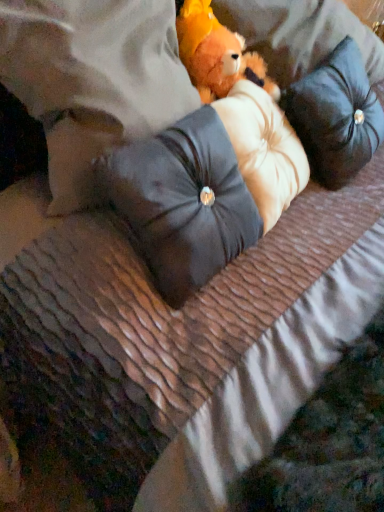
Question: From the image's perspective, does satin black pillow at center, which ranks as the second pillow in left-to-right order, appear lower than black velvet pillow at upper right, the 3th pillow when ordered from left to right?

Choices:
 (A) yes
 (B) no

Answer: (A)

Question: Is satin black pillow at center, which ranks as the second pillow in left-to-right order, touching black velvet pillow at upper right, placed as the 1th pillow when sorted from right to left?

Choices:
 (A) yes
 (B) no

Answer: (B)

Question: Is satin black pillow at center, the second pillow when ordered from right to left, to the left of black velvet pillow at upper right, placed as the 1th pillow when sorted from right to left, from the viewer's perspective?

Choices:
 (A) no
 (B) yes

Answer: (B)

Question: From the image's perspective, is satin black pillow at center, the second pillow when ordered from right to left, on black velvet pillow at upper right, the 3th pillow when ordered from left to right?

Choices:
 (A) yes
 (B) no

Answer: (B)

Question: Does satin black pillow at center, the second pillow when ordered from right to left, lie behind black velvet pillow at upper right, placed as the 1th pillow when sorted from right to left?

Choices:
 (A) no
 (B) yes

Answer: (A)

Question: From the image's perspective, is leather-like pillow at center, the third pillow from the right, positioned above or below black velvet pillow at upper right, placed as the 1th pillow when sorted from right to left?

Choices:
 (A) below
 (B) above

Answer: (B)

Question: From a real-world perspective, is leather-like pillow at center, which is counted as the first pillow, starting from the left, positioned above or below black velvet pillow at upper right, placed as the 1th pillow when sorted from right to left?

Choices:
 (A) below
 (B) above

Answer: (B)

Question: Considering the relative positions of leather-like pillow at center, the third pillow from the right, and black velvet pillow at upper right, placed as the 1th pillow when sorted from right to left, in the image provided, is leather-like pillow at center, the third pillow from the right, to the left or to the right of black velvet pillow at upper right, placed as the 1th pillow when sorted from right to left,?

Choices:
 (A) right
 (B) left

Answer: (B)

Question: Considering the positions of leather-like pillow at center, the third pillow from the right, and black velvet pillow at upper right, the 3th pillow when ordered from left to right, in the image, is leather-like pillow at center, the third pillow from the right, bigger or smaller than black velvet pillow at upper right, the 3th pillow when ordered from left to right,?

Choices:
 (A) small
 (B) big

Answer: (B)

Question: Relative to fluffy orange teddy bear at center, is black velvet pillow at upper right, the 3th pillow when ordered from left to right, in front or behind?

Choices:
 (A) front
 (B) behind

Answer: (A)

Question: From their relative heights in the image, would you say black velvet pillow at upper right, the 3th pillow when ordered from left to right, is taller or shorter than fluffy orange teddy bear at center?

Choices:
 (A) short
 (B) tall

Answer: (B)

Question: Is black velvet pillow at upper right, the 3th pillow when ordered from left to right, inside the boundaries of fluffy orange teddy bear at center, or outside?

Choices:
 (A) inside
 (B) outside

Answer: (B)

Question: Is point (339, 111) closer or farther from the camera than point (193, 48)?

Choices:
 (A) farther
 (B) closer

Answer: (A)

Question: Which is correct: fluffy orange teddy bear at center is inside satin black pillow at center, which ranks as the second pillow in left-to-right order, or outside of it?

Choices:
 (A) inside
 (B) outside

Answer: (B)

Question: Would you say fluffy orange teddy bear at center is to the left or to the right of satin black pillow at center, the second pillow when ordered from right to left, in the picture?

Choices:
 (A) left
 (B) right

Answer: (B)